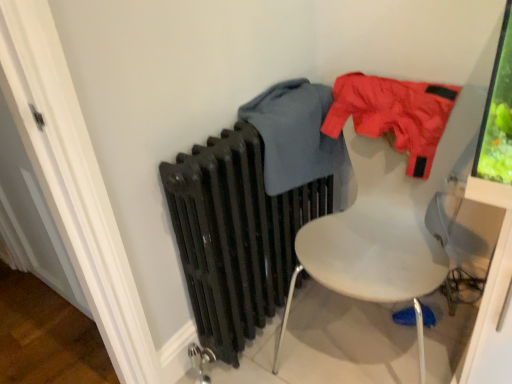
Question: Considering the positions of matte gray sweater at center, which appears as the second clothing when viewed from the right, and matte nylon jacket at upper right, which is counted as the first clothing, starting from the right, in the image, is matte gray sweater at center, which appears as the second clothing when viewed from the right, wider or thinner than matte nylon jacket at upper right, which is counted as the first clothing, starting from the right,?

Choices:
 (A) thin
 (B) wide

Answer: (B)

Question: From a real-world perspective, is matte gray sweater at center, positioned as the 1th clothing in left-to-right order, physically located above or below matte nylon jacket at upper right, which is counted as the first clothing, starting from the right?

Choices:
 (A) below
 (B) above

Answer: (A)

Question: Considering the real-world distances, which object is closest to the matte black radiator at center?

Choices:
 (A) white plastic chair at upper right
 (B) matte gray sweater at center, which appears as the second clothing when viewed from the right
 (C) matte nylon jacket at upper right, which is the second clothing from left to right

Answer: (B)

Question: Estimate the real-world distances between objects in this image. Which object is closer to the white plastic chair at upper right?

Choices:
 (A) matte gray sweater at center, positioned as the 1th clothing in left-to-right order
 (B) matte black radiator at center
 (C) matte nylon jacket at upper right, which is counted as the first clothing, starting from the right

Answer: (C)